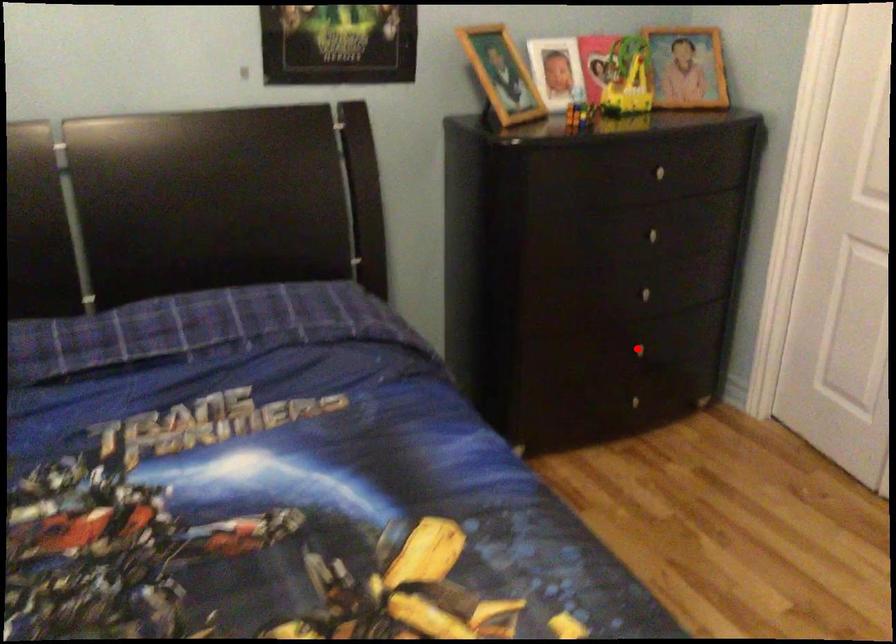
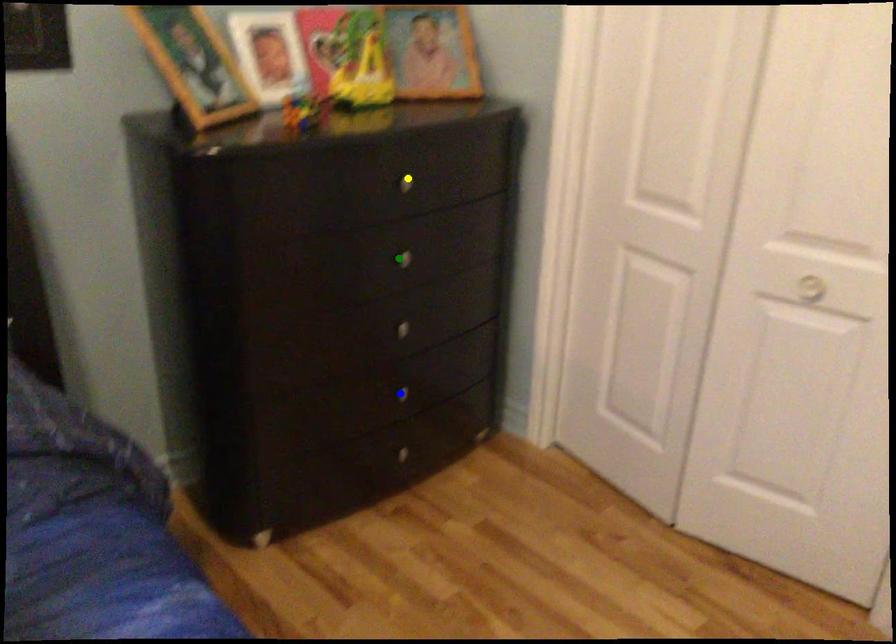
Question: I am providing you with two images of the same scene from different viewpoints. A red point is marked on the first image. You are given multiple points on the second image. Which point in image 2 represents the same 3d spot as the red point in image 1?

Choices:
 (A) blue point
 (B) yellow point
 (C) green point

Answer: (A)